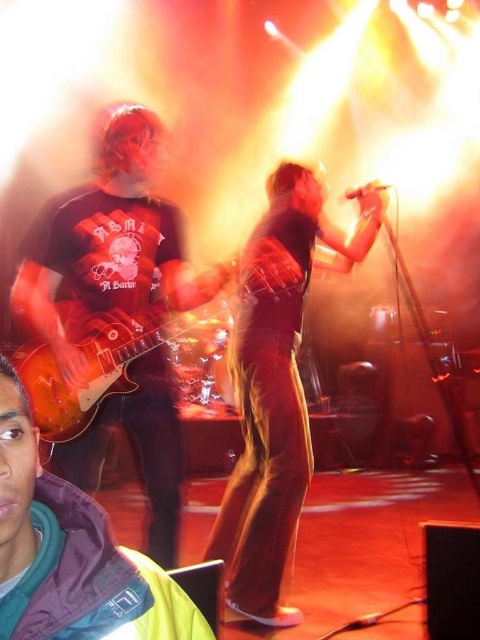
Can you confirm if shiny red guitar at left is positioned below glossy wood guitar at left?

Yes.

Is point (168, 628) positioned behind point (159, 308)?

No, (168, 628) is closer to viewer.

Identify the location of shiny red guitar at left. Image resolution: width=480 pixels, height=640 pixels. (72, 554).

Is matte black guitar at center shorter than shiny black microphone at center?

No.

Does matte black guitar at center have a lesser width compared to shiny black microphone at center?

In fact, matte black guitar at center might be wider than shiny black microphone at center.

Does point (137, 228) come farther from viewer compared to point (308, 266)?

No.

Where is `matte black guitar at center`? matte black guitar at center is located at coordinates (276, 384).

Can you confirm if shiny black microphone at center is positioned to the right of glossy wood guitar at left?

Yes, shiny black microphone at center is to the right of glossy wood guitar at left.

Describe the element at coordinates (276, 388) in the screenshot. The width and height of the screenshot is (480, 640). I see `shiny black microphone at center` at that location.

Who is more distant from viewer, (280,240) or (71,369)?

The point (280,240) is more distant.

Find the location of a particular element. Image resolution: width=480 pixels, height=640 pixels. shiny black microphone at center is located at coordinates (276, 388).